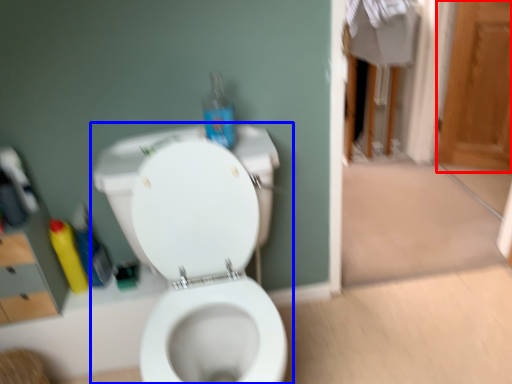
Question: Which of the following is the farthest to the observer, screen door (highlighted by a red box) or toilet (highlighted by a blue box)?

Choices:
 (A) screen door
 (B) toilet

Answer: (A)